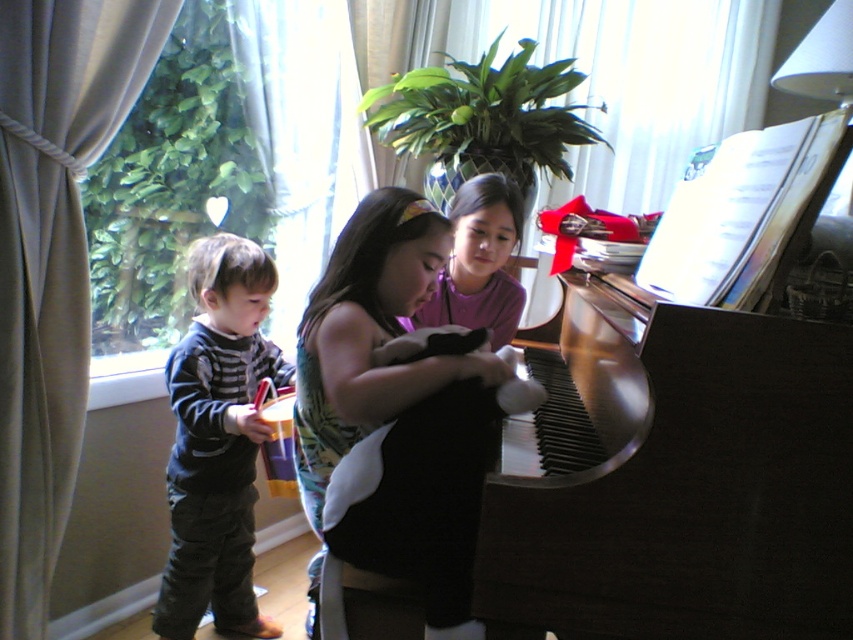
Measure the distance from black fabric dress at center to matte purple shirt at center.

black fabric dress at center is 20.68 inches away from matte purple shirt at center.

Can you confirm if black fabric dress at center is positioned to the right of matte purple shirt at center?

No, black fabric dress at center is not to the right of matte purple shirt at center.

Does point (300, 497) lie in front of point (492, 232)?

That is True.

This screenshot has width=853, height=640. Find the location of `black fabric dress at center`. black fabric dress at center is located at coordinates (354, 304).

Is dark blue striped sweater at left shorter than black fabric dress at center?

Incorrect, dark blue striped sweater at left's height does not fall short of black fabric dress at center's.

Is point (231, 369) behind point (300, 410)?

Yes, it is.

Where is `dark blue striped sweater at left`? The height and width of the screenshot is (640, 853). dark blue striped sweater at left is located at coordinates (218, 440).

Is dark blue striped sweater at left bigger than matte purple shirt at center?

Correct, dark blue striped sweater at left is larger in size than matte purple shirt at center.

Who is lower down, dark blue striped sweater at left or matte purple shirt at center?

dark blue striped sweater at left

The width and height of the screenshot is (853, 640). What do you see at coordinates (218, 440) in the screenshot? I see `dark blue striped sweater at left` at bounding box center [218, 440].

I want to click on dark blue striped sweater at left, so click(218, 440).